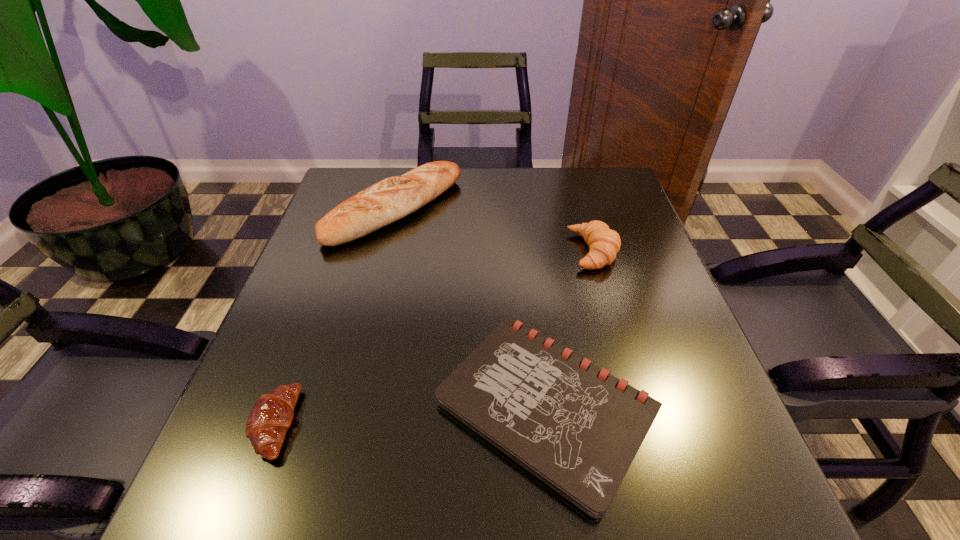
In the image, there is a desktop. Where is `vacant space at the left edge`? vacant space at the left edge is located at coordinates (343, 328).

Where is `free space at the right edge of the desktop`? This screenshot has height=540, width=960. free space at the right edge of the desktop is located at coordinates (706, 409).

Identify the location of vacant region at the far left corner of the desktop. This screenshot has height=540, width=960. (351, 188).

This screenshot has width=960, height=540. In order to click on vacant space at the far right corner of the desktop in this screenshot , I will do `click(603, 195)`.

I want to click on free space between the third shortest object and the notebook, so click(570, 329).

Find the location of a particular element. This screenshot has width=960, height=540. vacant space that is in between the baguet and the third shortest object is located at coordinates (494, 231).

Where is `vacant point located between the shortest object and the nearer crescent roll`? The height and width of the screenshot is (540, 960). vacant point located between the shortest object and the nearer crescent roll is located at coordinates (410, 415).

Where is `vacant area that lies between the tallest object and the shortest object`? vacant area that lies between the tallest object and the shortest object is located at coordinates (470, 308).

The image size is (960, 540). In order to click on vacant space that is in between the second shortest object and the right crescent roll in this screenshot , I will do `click(434, 338)`.

Image resolution: width=960 pixels, height=540 pixels. I want to click on vacant area that lies between the notebook and the shorter crescent roll, so click(410, 415).